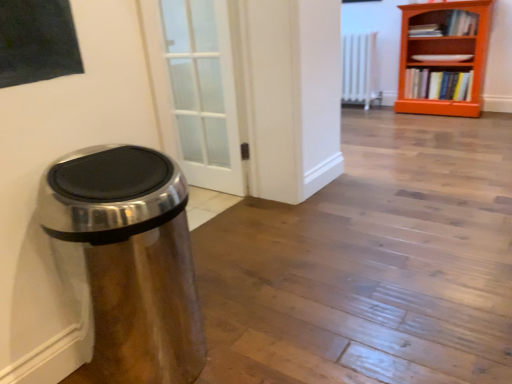
What do you see at coordinates (130, 259) in the screenshot? Image resolution: width=512 pixels, height=384 pixels. I see `satin metallic trash can at left` at bounding box center [130, 259].

You are a GUI agent. You are given a task and a screenshot of the screen. Output one action in this format:
    pyautogui.click(x=<x>, y=<y>)
    Task: Click on the satin metallic trash can at left
    
    Given the screenshot: What is the action you would take?
    pyautogui.click(x=130, y=259)

Looking at the image, does white metallic radiator at center seem bigger or smaller compared to orange wooden bookcase at upper right?

Clearly, white metallic radiator at center is smaller in size than orange wooden bookcase at upper right.

Based on the photo, from a real-world perspective, between white metallic radiator at center and orange wooden bookcase at upper right, who is vertically lower?

From a 3D spatial view, white metallic radiator at center is below.

Between white metallic radiator at center and orange wooden bookcase at upper right, which one appears on the left side from the viewer's perspective?

Positioned to the left is white metallic radiator at center.

Which object is further away from the camera taking this photo, hardcover book at right, which is the 2th book from top to bottom, or satin metallic trash can at left?

hardcover book at right, which is the 2th book from top to bottom, is more distant.

Based on the photo, which point is more distant from viewer, [436,81] or [193,370]?

The point [436,81] is behind.

From the image's perspective, is hardcover book at right, which appears as the 1th book when ordered from the bottom, located above or below satin metallic trash can at left?

hardcover book at right, which appears as the 1th book when ordered from the bottom, is situated higher than satin metallic trash can at left in the image.

Is hardcover book at right, which is the 2th book from top to bottom, surrounding satin metallic trash can at left?

No, satin metallic trash can at left is located outside of hardcover book at right, which is the 2th book from top to bottom.

Considering the relative sizes of satin metallic trash can at left and orange wooden bookcase at upper right in the image provided, is satin metallic trash can at left thinner than orange wooden bookcase at upper right?

No.

From a real-world perspective, between satin metallic trash can at left and orange wooden bookcase at upper right, who is vertically higher?

orange wooden bookcase at upper right, from a real-world perspective.

Visually, is satin metallic trash can at left positioned to the left or to the right of orange wooden bookcase at upper right?

satin metallic trash can at left is to the left of orange wooden bookcase at upper right.

How different are the orientations of satin metallic trash can at left and orange wooden bookcase at upper right in degrees?

90.3 degrees separate the facing orientations of satin metallic trash can at left and orange wooden bookcase at upper right.

In terms of width, does orange wooden bookcase at upper right look wider or thinner when compared to hardcover book at right, which is the 2th book from top to bottom?

orange wooden bookcase at upper right is wider than hardcover book at right, which is the 2th book from top to bottom.

From the image's perspective, is orange wooden bookcase at upper right beneath hardcover book at right, which is the 2th book from top to bottom?

No.

Identify the location of bookcase in front of the hardcover book at right, which is the 2th book from top to bottom. (443, 54).

Between orange wooden bookcase at upper right and hardcover book at right, which appears as the 1th book when ordered from the bottom, which one appears on the right side from the viewer's perspective?

hardcover book at right, which appears as the 1th book when ordered from the bottom.

From a real-world perspective, is white metallic radiator at center over satin metallic trash can at left?

Yes, from a real-world perspective, white metallic radiator at center is above satin metallic trash can at left.

In terms of size, does white metallic radiator at center appear bigger or smaller than satin metallic trash can at left?

In the image, white metallic radiator at center appears to be smaller than satin metallic trash can at left.

Consider the image. Is white metallic radiator at center oriented towards satin metallic trash can at left?

Yes.

Is point (359, 82) less distant than point (58, 206)?

No, (359, 82) is further to viewer.

From a real-world perspective, is white metallic radiator at center located beneath hardcover book at upper right, which is counted as the first book, starting from the top?

Yes, from a real-world perspective, white metallic radiator at center is beneath hardcover book at upper right, which is counted as the first book, starting from the top.

Is white metallic radiator at center thinner than hardcover book at upper right, the 2th book ordered from the bottom?

Incorrect, the width of white metallic radiator at center is not less than that of hardcover book at upper right, the 2th book ordered from the bottom.

Does white metallic radiator at center lie in front of hardcover book at upper right, which is counted as the first book, starting from the top?

No, white metallic radiator at center is behind hardcover book at upper right, which is counted as the first book, starting from the top.

From the white metallic radiator at center, count 2nd books forward and point to it. Please provide its 2D coordinates.

[(448, 25)]

There is a white metallic radiator at center. Identify the location of book above it (from a real-world perspective). The height and width of the screenshot is (384, 512). (448, 25).

Measure the distance between hardcover book at upper right, which is counted as the first book, starting from the top, and white metallic radiator at center.

The distance of hardcover book at upper right, which is counted as the first book, starting from the top, from white metallic radiator at center is 25.73 inches.

From a real-world perspective, between hardcover book at upper right, the 2th book ordered from the bottom, and white metallic radiator at center, who is vertically higher?

hardcover book at upper right, the 2th book ordered from the bottom, from a real-world perspective.

This screenshot has width=512, height=384. I want to click on bookcase in front of the white metallic radiator at center, so click(x=443, y=54).

From the image's perspective, starting from the satin metallic trash can at left, which book is the 1st one above? Please provide its 2D coordinates.

[(438, 84)]

From the image, which object appears to be farther from satin metallic trash can at left, hardcover book at right, which appears as the 1th book when ordered from the bottom, or hardcover book at upper right, the 2th book ordered from the bottom?

hardcover book at upper right, the 2th book ordered from the bottom.

Which object lies further to the anchor point orange wooden bookcase at upper right, satin metallic trash can at left or white metallic radiator at center?

satin metallic trash can at left lies further to orange wooden bookcase at upper right than the other object.

Estimate the real-world distances between objects in this image. Which object is closer to satin metallic trash can at left, white metallic radiator at center or hardcover book at right, which appears as the 1th book when ordered from the bottom?

The object closer to satin metallic trash can at left is hardcover book at right, which appears as the 1th book when ordered from the bottom.

Which object lies nearer to the anchor point white metallic radiator at center, hardcover book at right, which appears as the 1th book when ordered from the bottom, or orange wooden bookcase at upper right?

orange wooden bookcase at upper right.

Based on their spatial positions, is orange wooden bookcase at upper right or hardcover book at right, which is the 2th book from top to bottom, further from satin metallic trash can at left?

hardcover book at right, which is the 2th book from top to bottom.

When comparing their distances from satin metallic trash can at left, does hardcover book at right, which is the 2th book from top to bottom, or white metallic radiator at center seem further?

white metallic radiator at center is positioned further to the anchor satin metallic trash can at left.

Considering their positions, is satin metallic trash can at left positioned further to hardcover book at right, which is the 2th book from top to bottom, than hardcover book at upper right, which is counted as the first book, starting from the top?

The object further to hardcover book at right, which is the 2th book from top to bottom, is satin metallic trash can at left.

Considering their positions, is white metallic radiator at center positioned further to orange wooden bookcase at upper right than satin metallic trash can at left?

satin metallic trash can at left lies further to orange wooden bookcase at upper right than the other object.

Where is `bookcase between satin metallic trash can at left and white metallic radiator at center along the z-axis`? The height and width of the screenshot is (384, 512). bookcase between satin metallic trash can at left and white metallic radiator at center along the z-axis is located at coordinates (443, 54).

The height and width of the screenshot is (384, 512). I want to click on bookcase between white metallic radiator at center and hardcover book at right, which is the 2th book from top to bottom, so click(443, 54).

Locate an element on the screen. bookcase between satin metallic trash can at left and hardcover book at right, which appears as the 1th book when ordered from the bottom, from front to back is located at coordinates [443, 54].

Locate an element on the screen. Image resolution: width=512 pixels, height=384 pixels. bookcase between hardcover book at upper right, the 2th book ordered from the bottom, and hardcover book at right, which appears as the 1th book when ordered from the bottom, in the vertical direction is located at coordinates (443, 54).